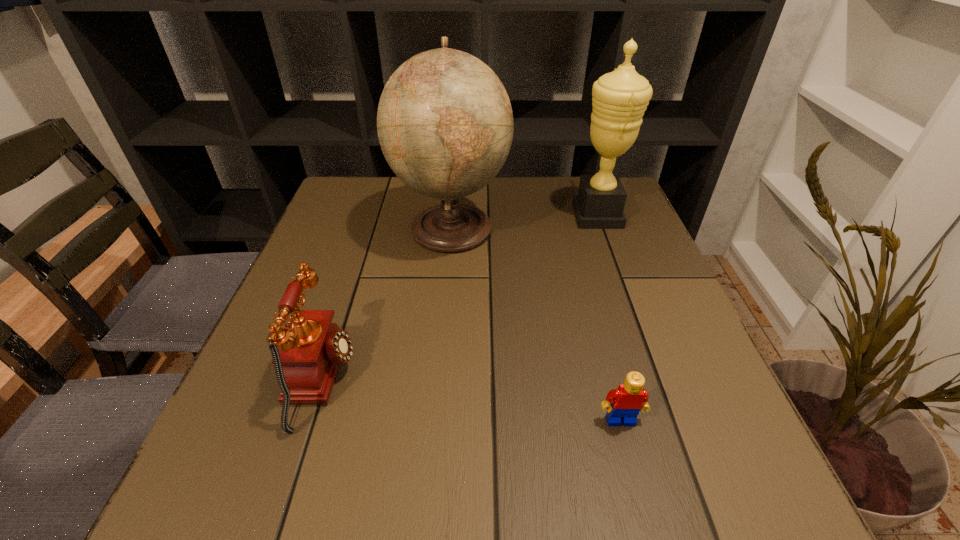
This screenshot has width=960, height=540. What are the coordinates of `vacant space at the right edge` in the screenshot? It's located at (615, 269).

In the image, there is a desktop. Where is `vacant space at the near left corner`? Image resolution: width=960 pixels, height=540 pixels. vacant space at the near left corner is located at coordinates (255, 512).

What are the coordinates of `free space between the trophy cup and the second object from left to right` in the screenshot? It's located at (524, 221).

Identify the location of vacant area that lies between the third object from right to left and the trophy cup. (524, 221).

Find the location of a particular element. This screenshot has width=960, height=540. vacant area that lies between the trophy cup and the globe is located at coordinates (524, 221).

The image size is (960, 540). In order to click on empty space between the third tallest object and the shortest object in this screenshot , I will do `click(471, 400)`.

The height and width of the screenshot is (540, 960). Identify the location of vacant space that is in between the telephone and the trophy cup. tap(460, 298).

This screenshot has width=960, height=540. Find the location of `vacant point located between the second shortest object and the trophy cup`. vacant point located between the second shortest object and the trophy cup is located at coordinates (460, 298).

You are a GUI agent. You are given a task and a screenshot of the screen. Output one action in this format:
    pyautogui.click(x=<x>, y=<y>)
    Task: Click on the free spot between the globe and the trophy cup
    
    Given the screenshot: What is the action you would take?
    pyautogui.click(x=524, y=221)

Find the location of a particular element. Image resolution: width=960 pixels, height=540 pixels. free spot between the trophy cup and the Lego is located at coordinates (609, 318).